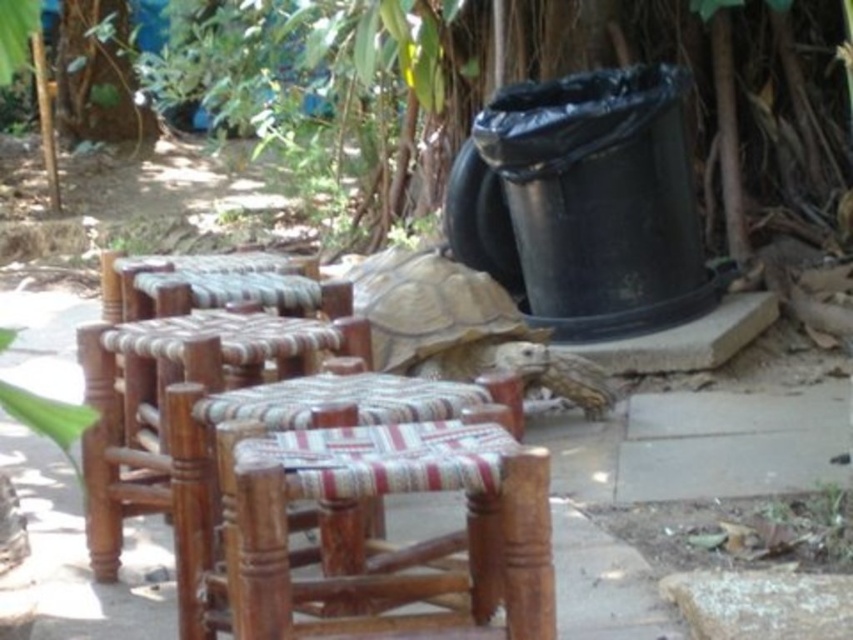
Is point (345, 291) in front of point (497, 326)?

Yes, it is.

From the picture: Can you confirm if wooden stool at left is positioned above brown textured shell at center?

No, wooden stool at left is not above brown textured shell at center.

Where is `wooden stool at left`? wooden stool at left is located at coordinates (164, 396).